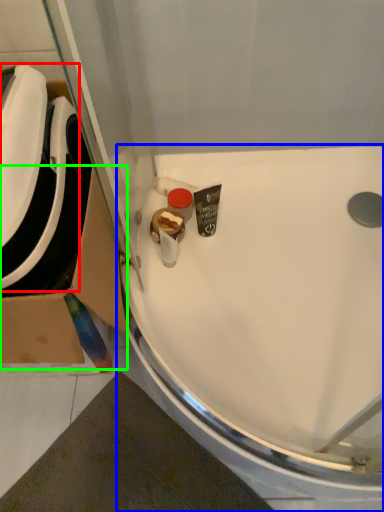
Question: Based on their relative distances, which object is farther from sink (highlighted by a red box)? Choose from sink (highlighted by a blue box) and cardboard box (highlighted by a green box).

Choices:
 (A) sink
 (B) cardboard box

Answer: (A)